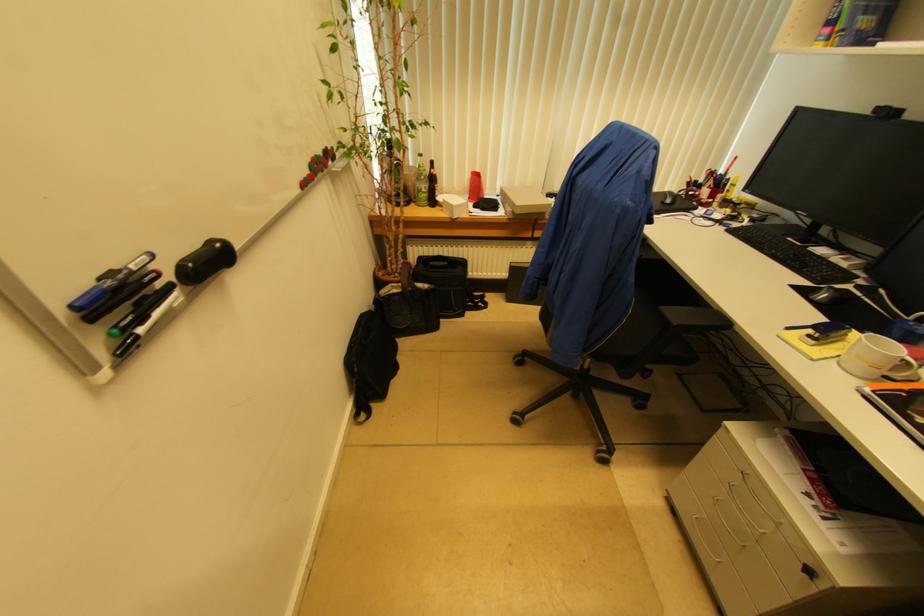
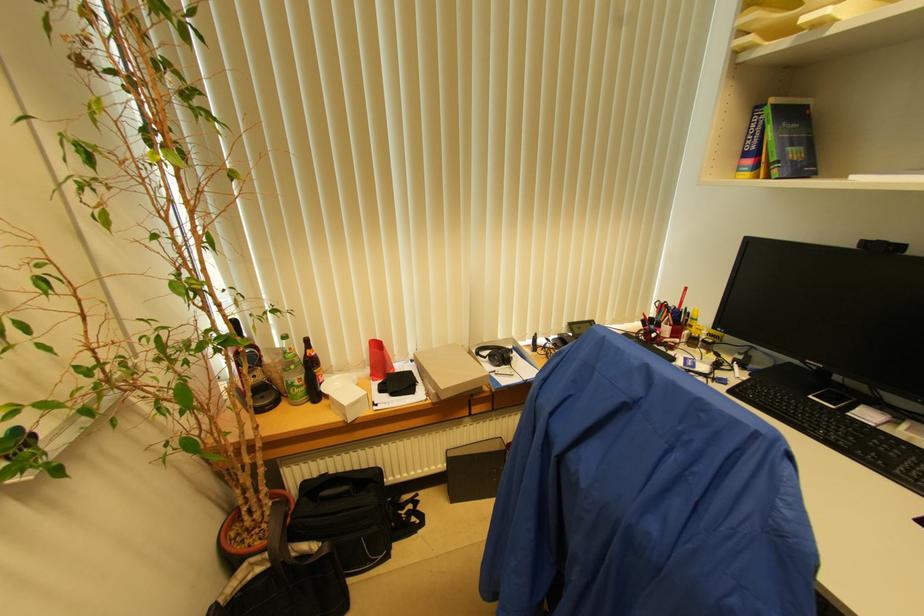
The point at (404, 290) is marked in the first image. Where is the corresponding point in the second image?

(273, 561)